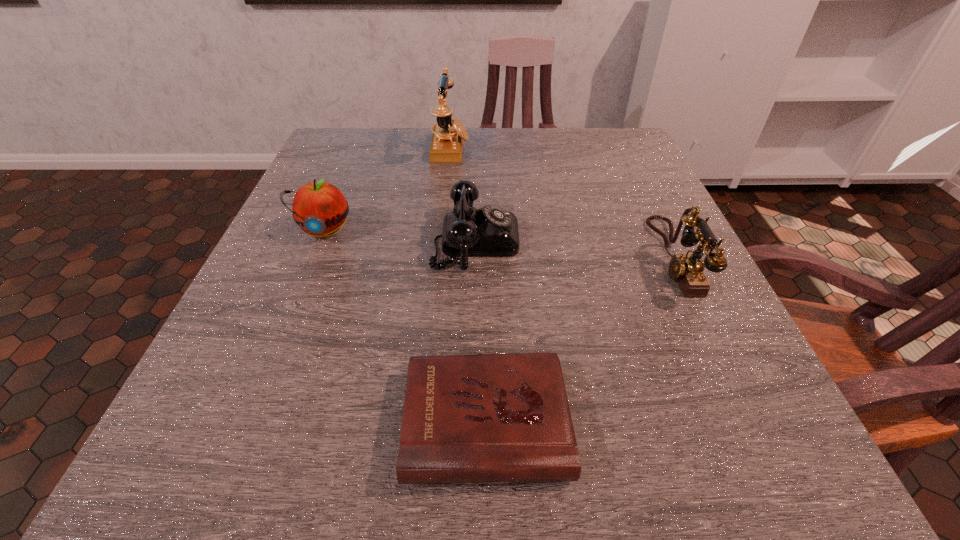
Locate an element on the screen. Image resolution: width=960 pixels, height=540 pixels. the farthest telephone is located at coordinates (448, 134).

The height and width of the screenshot is (540, 960). What are the coordinates of `the tallest telephone` in the screenshot? It's located at (448, 134).

You are a GUI agent. You are given a task and a screenshot of the screen. Output one action in this format:
    pyautogui.click(x=<x>, y=<y>)
    Task: Click on the rightmost telephone
    
    Given the screenshot: What is the action you would take?
    pyautogui.click(x=687, y=269)

Identify the location of the second tallest telephone. The image size is (960, 540). (687, 269).

Where is `apple`? This screenshot has height=540, width=960. apple is located at coordinates (320, 209).

You are a GUI agent. You are given a task and a screenshot of the screen. Output one action in this format:
    pyautogui.click(x=<x>, y=<y>)
    Task: Click on the fourth tallest object
    The width and height of the screenshot is (960, 540).
    Given the screenshot: What is the action you would take?
    pyautogui.click(x=490, y=231)

The width and height of the screenshot is (960, 540). Identify the location of the nearest object. (487, 418).

This screenshot has height=540, width=960. I want to click on the shortest object, so click(487, 418).

You are a GUI agent. You are given a task and a screenshot of the screen. Output one action in this format:
    pyautogui.click(x=<x>, y=<y>)
    Task: Click on the vacant space located 0.350m on the dial of the farthest object
    The image size is (960, 540).
    Given the screenshot: What is the action you would take?
    pyautogui.click(x=608, y=148)

What are the coordinates of `vacant space located 0.400m on the front-facing side of the rightmost object` in the screenshot? It's located at 442,258.